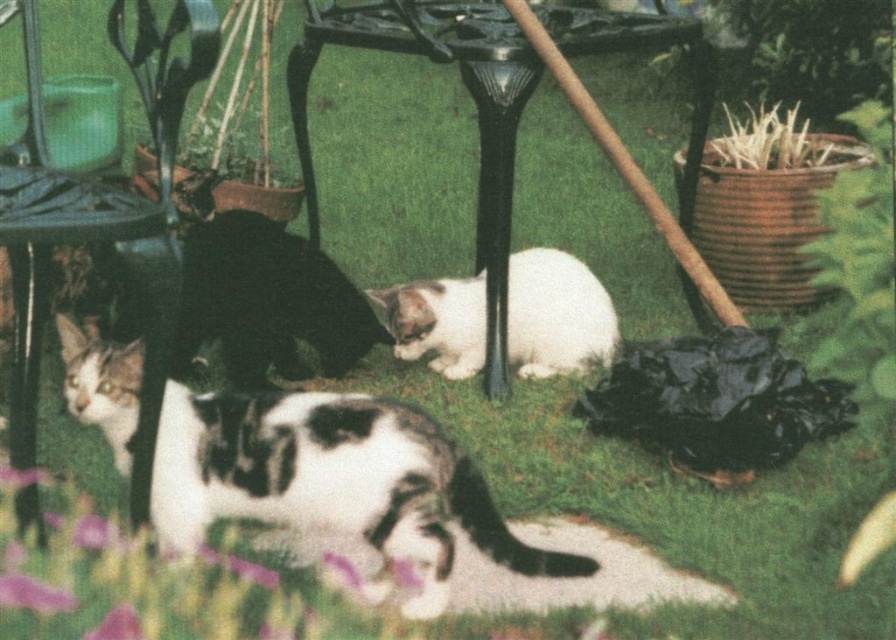
Based on the photo, measure the distance from white fur cat at center to white soft fur cat at center.

4.79 feet

Is white fur cat at center positioned behind white soft fur cat at center?

No, white fur cat at center is closer to the viewer.

Does point (307, 497) lie in front of point (463, 282)?

That is True.

The height and width of the screenshot is (640, 896). In order to click on white fur cat at center in this screenshot , I will do (333, 483).

Is point (354, 8) closer to camera compared to point (549, 332)?

No, (354, 8) is behind (549, 332).

Which is more to the left, metallic black chair at center or white soft fur cat at center?

Positioned to the left is white soft fur cat at center.

Is point (633, 182) closer to viewer compared to point (416, 346)?

Yes, point (633, 182) is in front of point (416, 346).

This screenshot has height=640, width=896. Identify the location of metallic black chair at center. (483, 332).

Who is taller, white fur cat at center or metallic black chair at left?

metallic black chair at left is taller.

Where is `white fur cat at center`? The width and height of the screenshot is (896, 640). white fur cat at center is located at coordinates (333, 483).

Between point (480, 500) and point (31, 243), which one is positioned behind?

The point (480, 500) is behind.

Locate an element on the screen. The image size is (896, 640). white fur cat at center is located at coordinates (333, 483).